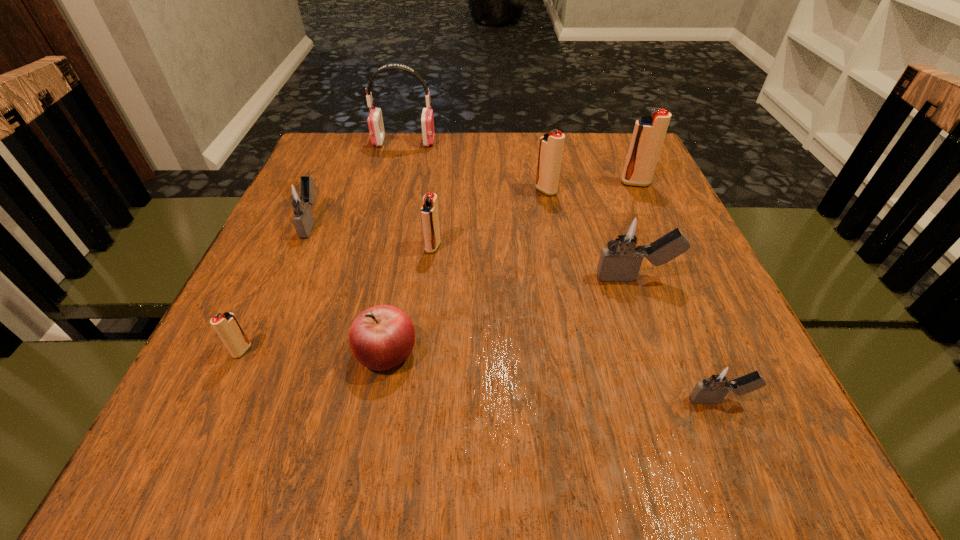
Find the location of `empty space between the apple and the second nearest igniter`. empty space between the apple and the second nearest igniter is located at coordinates (314, 352).

This screenshot has height=540, width=960. Find the location of `vacant point located between the pink earphone and the third igniter from left to right`. vacant point located between the pink earphone and the third igniter from left to right is located at coordinates (419, 194).

The image size is (960, 540). I want to click on empty location between the rightmost red igniter and the apple, so click(511, 267).

Find the location of `free point between the nearest igniter and the biggest red igniter`. free point between the nearest igniter and the biggest red igniter is located at coordinates (678, 292).

You are a GUI agent. You are given a task and a screenshot of the screen. Output one action in this format:
    pyautogui.click(x=<x>, y=<y>)
    Task: Click on the free spot between the biggest gray igniter and the third red igniter from left to right
    This screenshot has width=960, height=540.
    Given the screenshot: What is the action you would take?
    pyautogui.click(x=590, y=234)

Locate an element on the screen. This screenshot has height=540, width=960. vacant space in between the second biggest red igniter and the leftmost red igniter is located at coordinates (395, 271).

At what (x,y) coordinates should I click in order to perform the action: click on free area in between the farthest object and the tallest igniter. Please return your answer as a coordinate pair (x, y). This screenshot has height=540, width=960. Looking at the image, I should click on (519, 163).

Find the location of a particular element. The image size is (960, 540). free point between the nearest object and the apple is located at coordinates (553, 376).

Identify the location of vacant area that lies between the fifth nearest object and the biggest red igniter. The image size is (960, 540). (534, 215).

This screenshot has height=540, width=960. In order to click on free area in between the sixth nearest object and the rightmost red igniter in this screenshot , I will do `click(473, 202)`.